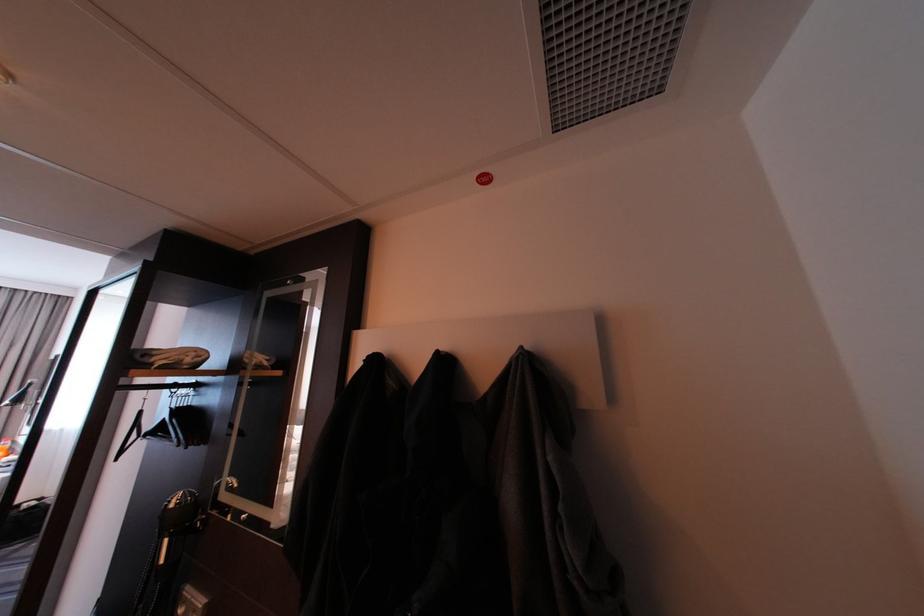
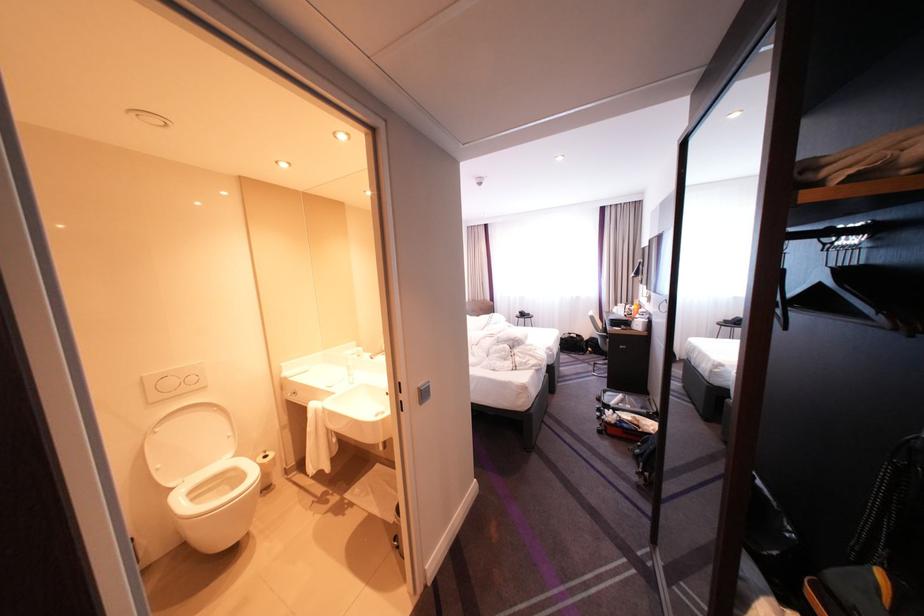
Question: Based on the continuous images, in which direction is the camera rotating? Reply with the corresponding letter.

Choices:
 (A) Left
 (B) Right
 (C) Up
 (D) Down

Answer: (A)